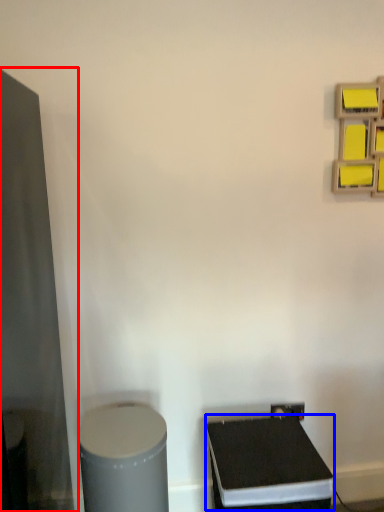
Question: Which of the following is the closest to the observer, glass door (highlighted by a red box) or wide (highlighted by a blue box)?

Choices:
 (A) glass door
 (B) wide

Answer: (A)